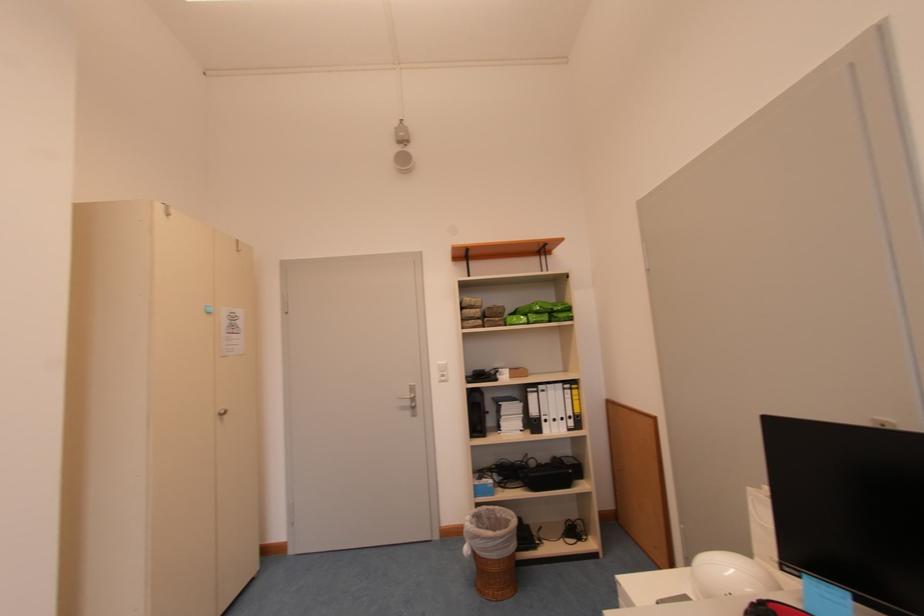
Which object does [492,549] point to?

This point indicates the wicker wastebasket.